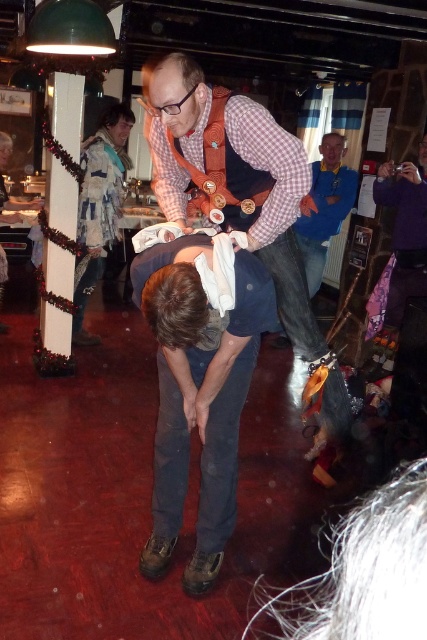
Question: Which point is farther from the camera taking this photo?

Choices:
 (A) (290, 250)
 (B) (321, 170)

Answer: (B)

Question: Is checkered fabric shirt at center to the left of blue cotton shirt at center from the viewer's perspective?

Choices:
 (A) yes
 (B) no

Answer: (A)

Question: Is checkered fabric shirt at center wider than blue cotton shirt at center?

Choices:
 (A) no
 (B) yes

Answer: (B)

Question: Can you confirm if checkered fabric shirt at center is positioned to the right of blue cotton shirt at center?

Choices:
 (A) no
 (B) yes

Answer: (A)